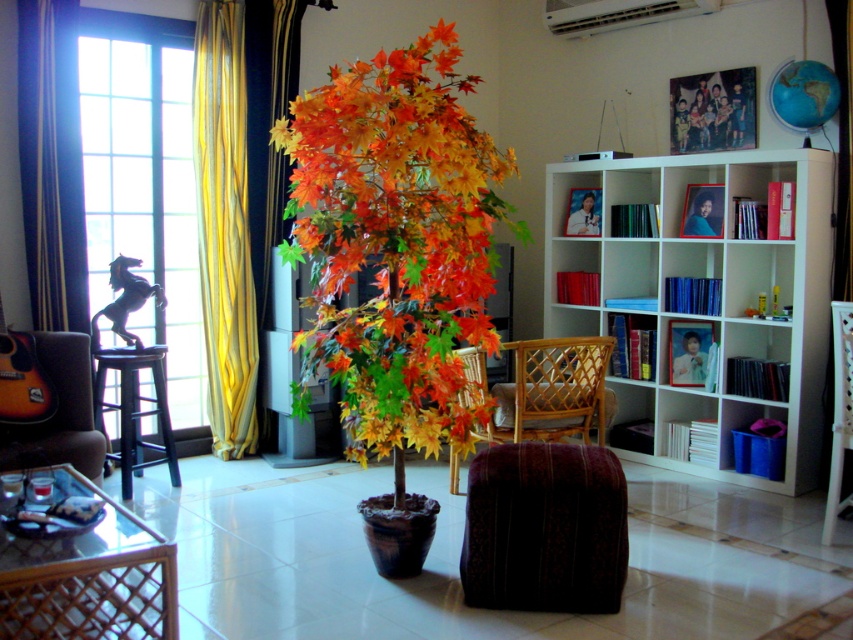
Question: Can you confirm if yellow/golden fabric curtain at left is positioned above bamboo woven armchair at center?

Choices:
 (A) no
 (B) yes

Answer: (B)

Question: Is woven wood armchair at lower left thinner than woven rattan armchair at center?

Choices:
 (A) yes
 (B) no

Answer: (B)

Question: Which object appears farthest from the camera in this image?

Choices:
 (A) yellow/golden fabric curtain at left
 (B) white woven armchair at right
 (C) black wood stool at left
 (D) woven rattan armchair at center

Answer: (C)

Question: Is yellow striped fabric at left wider than yellow/golden fabric curtain at left?

Choices:
 (A) yes
 (B) no

Answer: (A)

Question: Which point appears farthest from the camera in this image?

Choices:
 (A) (68, 371)
 (B) (463, 221)

Answer: (A)

Question: Which of the following is the closest to the observer?

Choices:
 (A) (71, 605)
 (B) (416, 401)
 (C) (836, 397)
 (D) (138, 440)

Answer: (A)